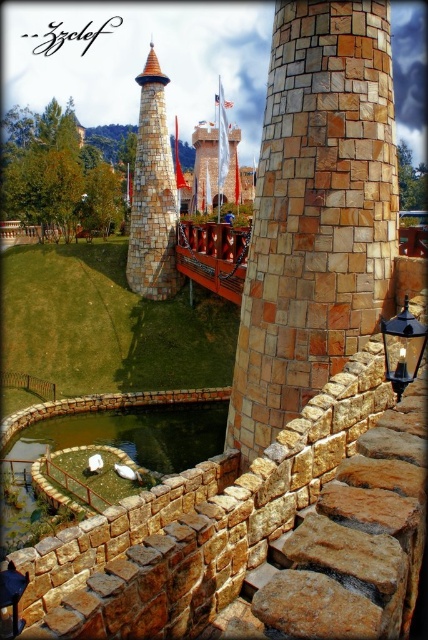
You are standing at the point marked by coordinates point (x=152, y=193) in the image. Looking around, you see the stone textured tower at center. What is the direction of the stone textured tower at center relative to your current position?

The stone textured tower at center is located at the point marked by coordinates point (x=152, y=193), so you are already at the base of the stone textured tower at center.

You are standing at the base of the stone wall in the foreground and want to walk towards the red wooden bridge connecting the two towers. There are two points marked on the path ahead of you at coordinates point (363, 337) and point (401, 364). Which point will you encounter first as you walk towards the bridge?

You will encounter point (401, 364) first because point (363, 337) is located behind it along your path towards the bridge.